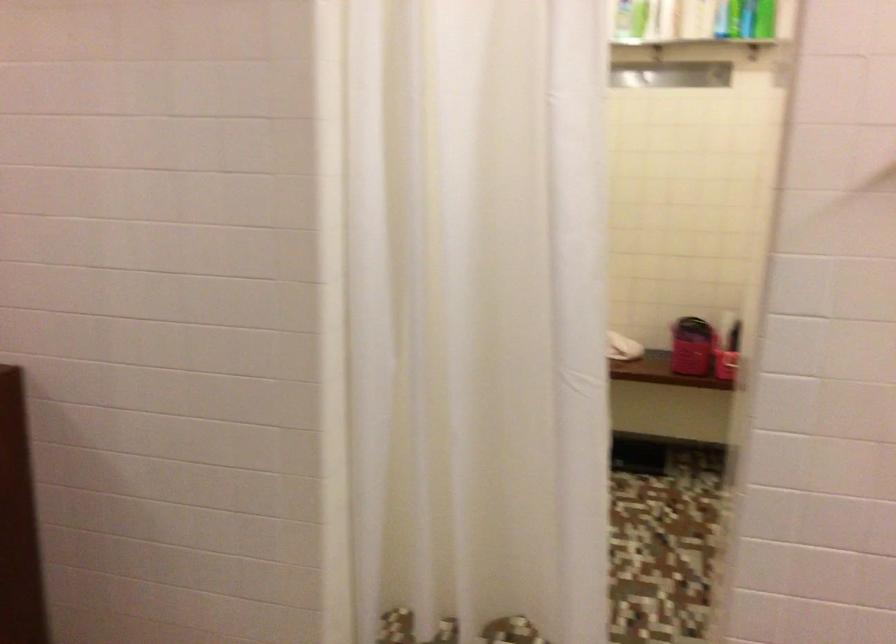
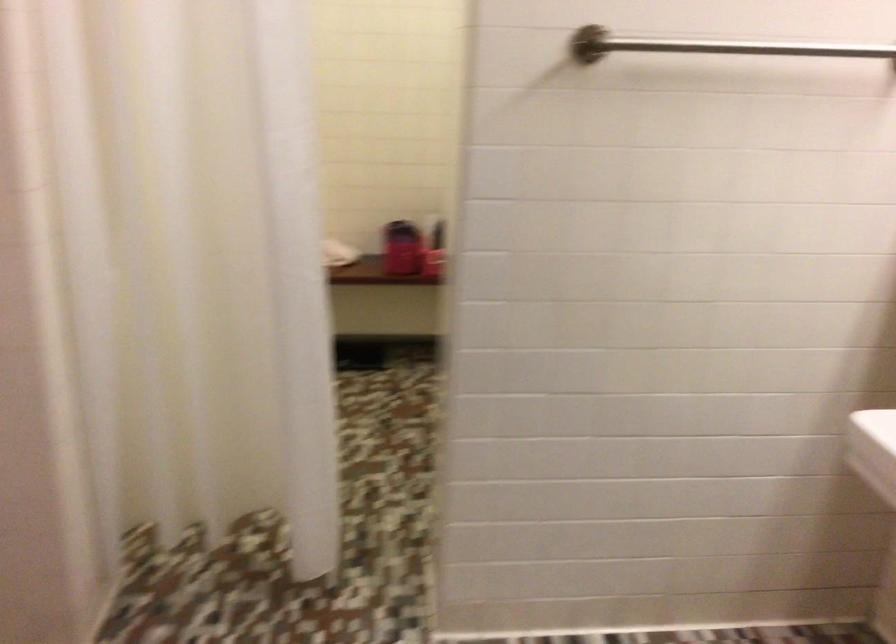
Question: The first image is from the beginning of the video and the second image is from the end. How did the camera likely rotate when shooting the video?

Choices:
 (A) Left
 (B) Right
 (C) Up
 (D) Down

Answer: (B)